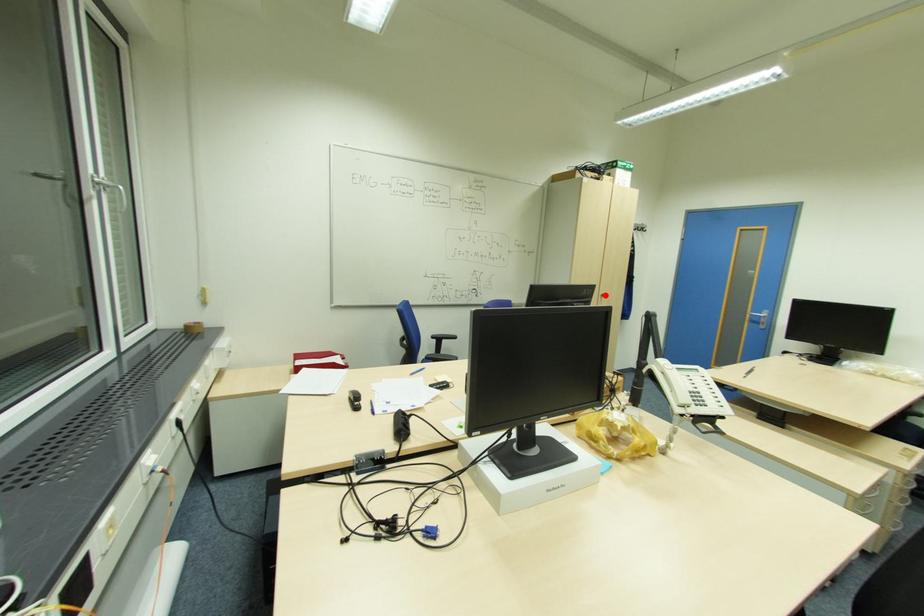
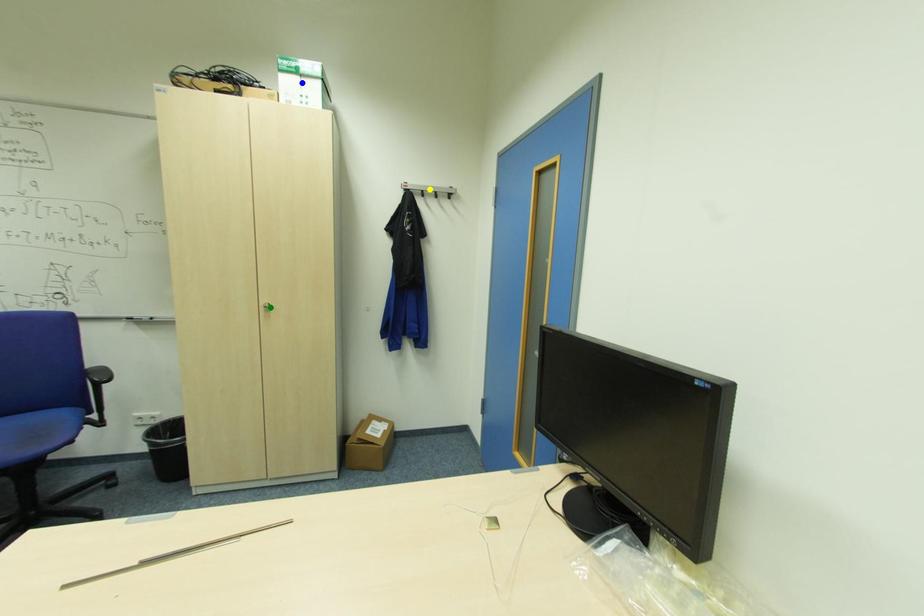
Question: I am providing you with two images of the same scene from different viewpoints. A red point is marked on the first image. You are given multiple points on the second image. Which mark in image 2 goes with the point in image 1?

Choices:
 (A) blue point
 (B) yellow point
 (C) green point

Answer: (C)